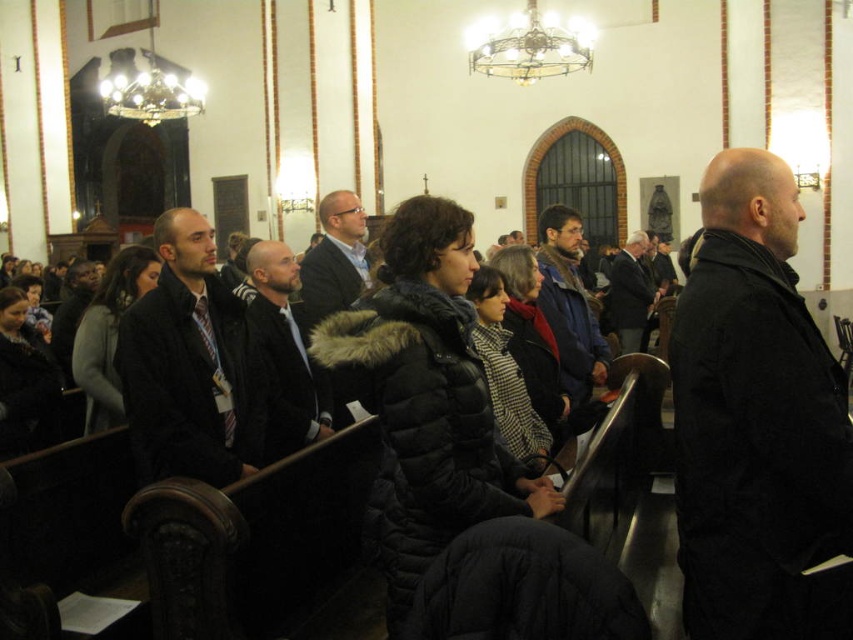
You are a photographer positioned at the back of the church. You notice two jackets at the center of the scene, a dark gray jacket at center and a matte black jacket at center. Which jacket is positioned to the left when viewed from your perspective?

The dark gray jacket at center is to the left of the matte black jacket at center, so the dark gray jacket at center is positioned to the left when viewed from your perspective.